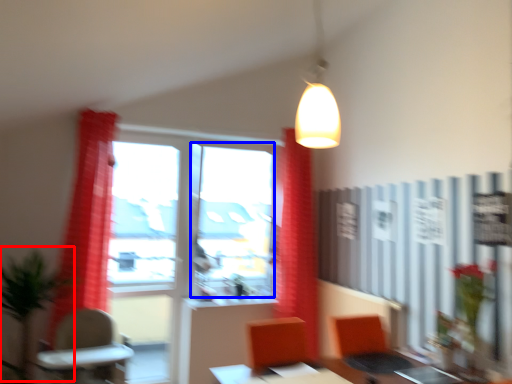
Question: Which point is further to the camera, plant (highlighted by a red box) or window screen (highlighted by a blue box)?

Choices:
 (A) plant
 (B) window screen

Answer: (B)